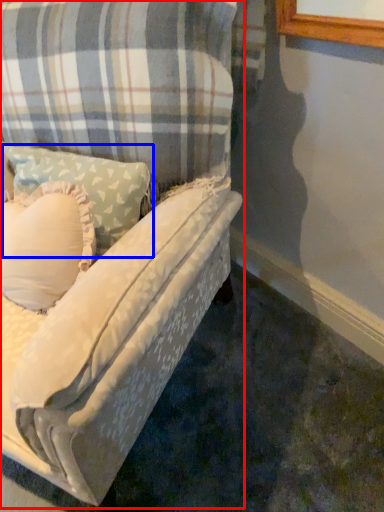
Question: Which of the following is the closest to the observer, studio couch (highlighted by a red box) or pillow (highlighted by a blue box)?

Choices:
 (A) studio couch
 (B) pillow

Answer: (A)